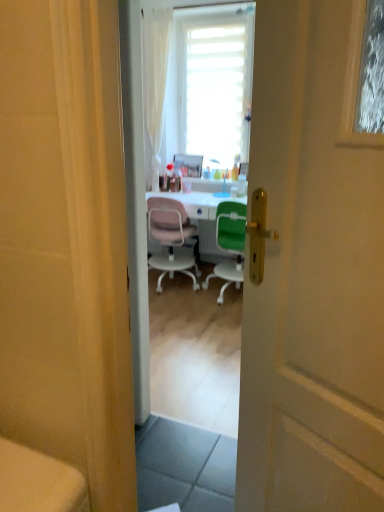
Identify the location of vacant area on top of wooden picture frame at center (from a real-world perspective). (188, 147).